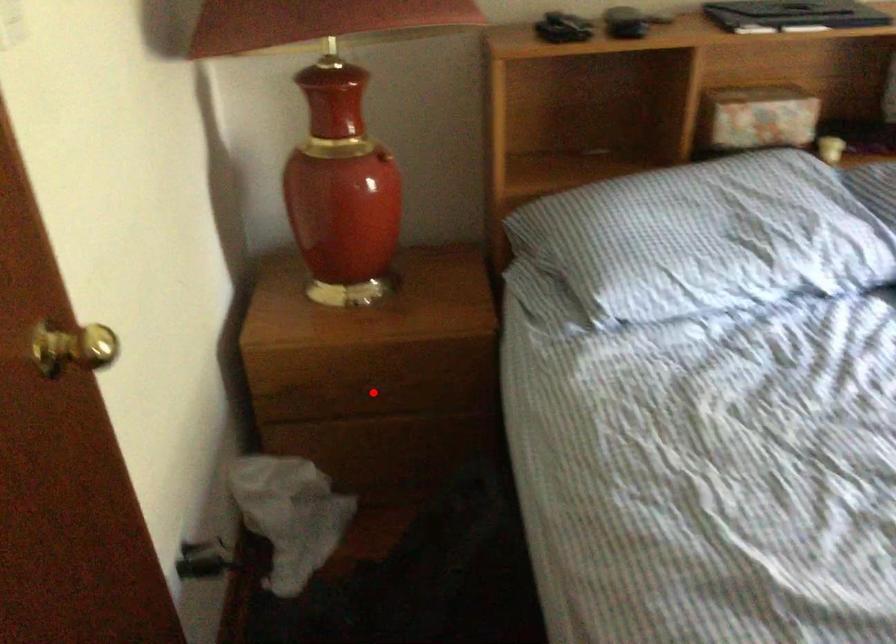
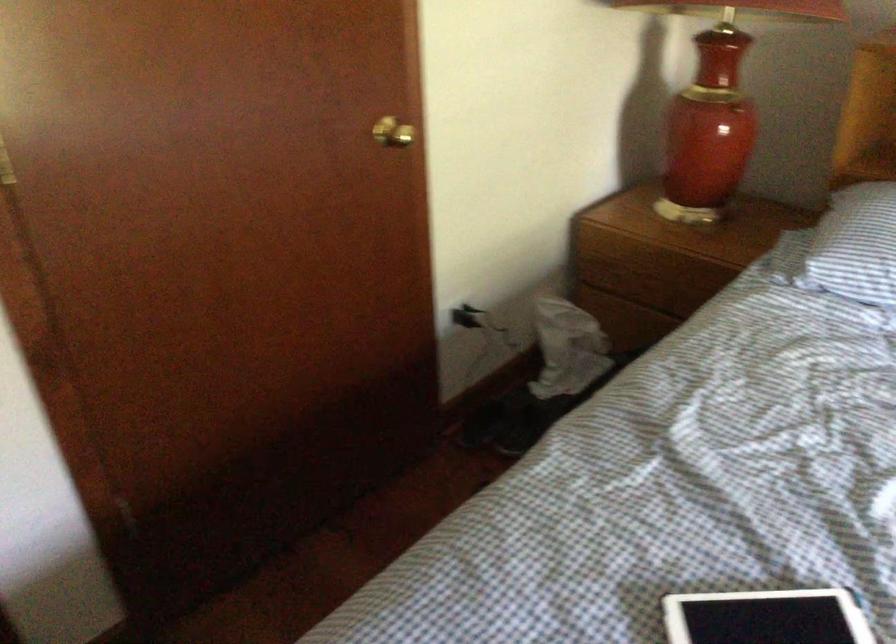
Question: I am providing you with two images of the same scene from different viewpoints. A red point is marked on the first image. Can you still see the location of the red point in image 2?

Choices:
 (A) Yes
 (B) No

Answer: (A)